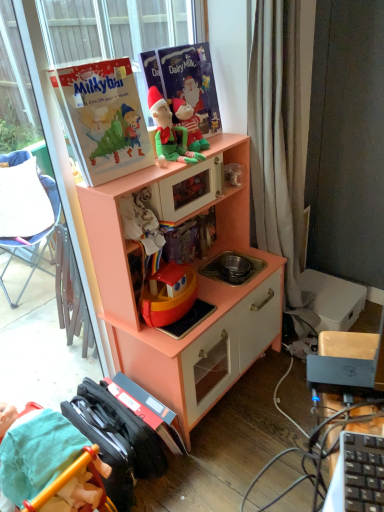
What is the approximate width of green plush toy at upper center, which is counted as the second person, starting from the left?

green plush toy at upper center, which is counted as the second person, starting from the left, is 5.16 inches wide.

You are a GUI agent. You are given a task and a screenshot of the screen. Output one action in this format:
    pyautogui.click(x=<x>, y=<y>)
    Task: Click on the peach wood toy kitchen at center
    The width and height of the screenshot is (384, 512).
    Given the screenshot: What is the action you would take?
    pyautogui.click(x=197, y=293)

The height and width of the screenshot is (512, 384). Describe the element at coordinates (103, 118) in the screenshot. I see `matte paperboard book at upper left, the 2th paperback book from the right` at that location.

Locate an element on the screen. The image size is (384, 512). green plush toy at upper center, marked as the 1th person in a right-to-left arrangement is located at coordinates (169, 132).

From the image's perspective, is smooth teal fabric at lower left, the 2th person viewed from the right, on top of green plush toy at upper center, which is counted as the second person, starting from the left?

No, from the image's perspective, smooth teal fabric at lower left, the 2th person viewed from the right, is not over green plush toy at upper center, which is counted as the second person, starting from the left.

From their relative heights in the image, would you say smooth teal fabric at lower left, the 2th person viewed from the right, is taller or shorter than green plush toy at upper center, the 2th person from the bottom?

In the image, smooth teal fabric at lower left, the 2th person viewed from the right, appears to be taller than green plush toy at upper center, the 2th person from the bottom.

Considering the sizes of objects smooth teal fabric at lower left, the 2th person in the top-to-bottom sequence, and green plush toy at upper center, marked as the 1th person in a right-to-left arrangement, in the image provided, who is thinner, smooth teal fabric at lower left, the 2th person in the top-to-bottom sequence, or green plush toy at upper center, marked as the 1th person in a right-to-left arrangement,?

Thinner between the two is green plush toy at upper center, marked as the 1th person in a right-to-left arrangement.

Considering the points (75, 448) and (197, 152), which point is in front, point (75, 448) or point (197, 152)?

The point (75, 448) is more forward.

Is green plush toy at upper center, the 2th person from the bottom, far away from smooth teal fabric at lower left, the 2th person viewed from the right?

green plush toy at upper center, the 2th person from the bottom, is actually quite close to smooth teal fabric at lower left, the 2th person viewed from the right.

Is green plush toy at upper center, marked as the 1th person in a right-to-left arrangement, taller than smooth teal fabric at lower left, which appears as the 1th person when ordered from the bottom?

No, green plush toy at upper center, marked as the 1th person in a right-to-left arrangement, is not taller than smooth teal fabric at lower left, which appears as the 1th person when ordered from the bottom.

Based on the photo, measure the distance between green plush toy at upper center, which is counted as the first person, starting from the top, and smooth teal fabric at lower left, the 2th person viewed from the right.

37.43 inches.

Is green plush toy at upper center, the 2th person from the bottom, at the right side of smooth teal fabric at lower left, positioned as the first person in left-to-right order?

Yes.

Based on the photo, which is correct: green plush toy at upper center, which is counted as the first person, starting from the top, is inside matte paperboard book at upper left, the 2th paperback book from the right, or outside of it?

green plush toy at upper center, which is counted as the first person, starting from the top, is located beyond the bounds of matte paperboard book at upper left, the 2th paperback book from the right.

Considering the relative sizes of green plush toy at upper center, which is counted as the first person, starting from the top, and matte paperboard book at upper left, arranged as the 1th paperback book when viewed from the left, in the image provided, is green plush toy at upper center, which is counted as the first person, starting from the top, thinner than matte paperboard book at upper left, arranged as the 1th paperback book when viewed from the left,?

Incorrect, the width of green plush toy at upper center, which is counted as the first person, starting from the top, is not less than that of matte paperboard book at upper left, arranged as the 1th paperback book when viewed from the left.

Is green plush toy at upper center, which is counted as the first person, starting from the top, bigger or smaller than matte paperboard book at upper left, arranged as the 1th paperback book when viewed from the left?

Considering their sizes, green plush toy at upper center, which is counted as the first person, starting from the top, takes up less space than matte paperboard book at upper left, arranged as the 1th paperback book when viewed from the left.

In the image, is green plush toy at upper center, the 2th person from the bottom, positioned in front of or behind matte paperboard book at upper left, the 2th paperback book from the right?

green plush toy at upper center, the 2th person from the bottom, is positioned farther from the viewer than matte paperboard book at upper left, the 2th paperback book from the right.

Are peach wood toy kitchen at center and green plush toy at upper center, marked as the 1th person in a right-to-left arrangement, making contact?

No, peach wood toy kitchen at center is not touching green plush toy at upper center, marked as the 1th person in a right-to-left arrangement.

Is peach wood toy kitchen at center oriented towards green plush toy at upper center, the 2th person from the bottom?

No, peach wood toy kitchen at center is not facing towards green plush toy at upper center, the 2th person from the bottom.

How distant is peach wood toy kitchen at center from green plush toy at upper center, which is counted as the first person, starting from the top?

18.49 inches.

Identify the location of cabinetry in front of the green plush toy at upper center, which is counted as the second person, starting from the left. This screenshot has width=384, height=512. (197, 293).

In the image, is matte paperboard book at upper left, the 2th paperback book from the right, on the left side or the right side of green plush toy at upper center, which is counted as the first person, starting from the top?

In the image, matte paperboard book at upper left, the 2th paperback book from the right, appears on the left side of green plush toy at upper center, which is counted as the first person, starting from the top.

Identify the location of person to the right of matte paperboard book at upper left, arranged as the 1th paperback book when viewed from the left. (169, 132).

Is matte paperboard book at upper left, the 2th paperback book from the right, further to the viewer compared to green plush toy at upper center, which is counted as the second person, starting from the left?

No, matte paperboard book at upper left, the 2th paperback book from the right, is closer to the camera.

Locate an element on the screen. The image size is (384, 512). person in front of the matte paperboard book at upper left, arranged as the 1th paperback book when viewed from the left is located at coordinates (48, 462).

Is smooth teal fabric at lower left, the 2th person viewed from the right, next to matte paperboard book at upper left, the 2th paperback book from the right?

No, smooth teal fabric at lower left, the 2th person viewed from the right, is not beside matte paperboard book at upper left, the 2th paperback book from the right.

Which of these two, smooth teal fabric at lower left, which appears as the 1th person when ordered from the bottom, or matte paperboard book at upper left, arranged as the 1th paperback book when viewed from the left, is smaller?

With smaller size is matte paperboard book at upper left, arranged as the 1th paperback book when viewed from the left.

Between green plush toy at upper center, the 2th person from the bottom, and peach wood toy kitchen at center, which one has more height?

With more height is peach wood toy kitchen at center.

Based on their sizes in the image, would you say green plush toy at upper center, which is counted as the second person, starting from the left, is bigger or smaller than peach wood toy kitchen at center?

In the image, green plush toy at upper center, which is counted as the second person, starting from the left, appears to be smaller than peach wood toy kitchen at center.

Is point (165, 151) positioned behind point (176, 339)?

No, (165, 151) is closer to viewer.

From the image's perspective, which object appears higher, green plush toy at upper center, which is counted as the second person, starting from the left, or peach wood toy kitchen at center?

From the image's view, green plush toy at upper center, which is counted as the second person, starting from the left, is above.

Find the location of a particular element. person located below the green plush toy at upper center, the 2th person from the bottom (from the image's perspective) is located at coordinates (48, 462).

Identify the location of person in front of the green plush toy at upper center, marked as the 1th person in a right-to-left arrangement. Image resolution: width=384 pixels, height=512 pixels. (48, 462).

Looking at this image, considering their positions, is matte paperboard book at upper left, arranged as the 1th paperback book when viewed from the left, positioned further to peach wood toy kitchen at center than smooth teal fabric at lower left, the 2th person in the top-to-bottom sequence?

smooth teal fabric at lower left, the 2th person in the top-to-bottom sequence, is further to peach wood toy kitchen at center.

From the image, which object appears to be nearer to peach wood toy kitchen at center, matte paperboard book at upper left, the 2th paperback book from the right, or matte paper book at upper center, which is the second paperback book in left-to-right order?

matte paperboard book at upper left, the 2th paperback book from the right, is closer to peach wood toy kitchen at center.

Based on their spatial positions, is green plush toy at upper center, marked as the 1th person in a right-to-left arrangement, or peach wood toy kitchen at center further from matte paper book at upper center, which is the second paperback book in left-to-right order?

peach wood toy kitchen at center lies further to matte paper book at upper center, which is the second paperback book in left-to-right order, than the other object.

Which object lies nearer to the anchor point green plush toy at upper center, marked as the 1th person in a right-to-left arrangement, matte paperboard book at upper left, arranged as the 1th paperback book when viewed from the left, or matte paper book at upper center, which is the second paperback book in left-to-right order?

matte paper book at upper center, which is the second paperback book in left-to-right order, is closer to green plush toy at upper center, marked as the 1th person in a right-to-left arrangement.

Considering their positions, is smooth teal fabric at lower left, the 2th person viewed from the right, positioned closer to green plush toy at upper center, marked as the 1th person in a right-to-left arrangement, than peach wood toy kitchen at center?

peach wood toy kitchen at center is closer to green plush toy at upper center, marked as the 1th person in a right-to-left arrangement.

Estimate the real-world distances between objects in this image. Which object is further from smooth teal fabric at lower left, which appears as the 1th person when ordered from the bottom, green plush toy at upper center, the 2th person from the bottom, or matte paperboard book at upper left, arranged as the 1th paperback book when viewed from the left?

Among the two, green plush toy at upper center, the 2th person from the bottom, is located further to smooth teal fabric at lower left, which appears as the 1th person when ordered from the bottom.

Considering their positions, is matte paper book at upper center, which is the second paperback book in left-to-right order, positioned further to green plush toy at upper center, the 2th person from the bottom, than matte paperboard book at upper left, arranged as the 1th paperback book when viewed from the left?

Based on the image, matte paperboard book at upper left, arranged as the 1th paperback book when viewed from the left, appears to be further to green plush toy at upper center, the 2th person from the bottom.

Looking at this image, which object lies further to the anchor point matte paperboard book at upper left, arranged as the 1th paperback book when viewed from the left, smooth teal fabric at lower left, which appears as the 1th person when ordered from the bottom, or matte paper book at upper center, which appears as the 1th paperback book when viewed from the right?

Among the two, smooth teal fabric at lower left, which appears as the 1th person when ordered from the bottom, is located further to matte paperboard book at upper left, arranged as the 1th paperback book when viewed from the left.

Find the location of a particular element. The height and width of the screenshot is (512, 384). paperback book between green plush toy at upper center, the 2th person from the bottom, and peach wood toy kitchen at center, in the vertical direction is located at coordinates (103, 118).

Where is `paperback book that lies between matte paper book at upper center, which appears as the 1th paperback book when viewed from the right, and smooth teal fabric at lower left, positioned as the first person in left-to-right order, from top to bottom`? This screenshot has height=512, width=384. paperback book that lies between matte paper book at upper center, which appears as the 1th paperback book when viewed from the right, and smooth teal fabric at lower left, positioned as the first person in left-to-right order, from top to bottom is located at coordinates (103, 118).

The image size is (384, 512). I want to click on paperback book between matte paper book at upper center, which appears as the 1th paperback book when viewed from the right, and peach wood toy kitchen at center vertically, so click(x=103, y=118).

Where is `person between matte paper book at upper center, which appears as the 1th paperback book when viewed from the right, and smooth teal fabric at lower left, positioned as the first person in left-to-right order, from top to bottom`? The image size is (384, 512). person between matte paper book at upper center, which appears as the 1th paperback book when viewed from the right, and smooth teal fabric at lower left, positioned as the first person in left-to-right order, from top to bottom is located at coordinates (169, 132).